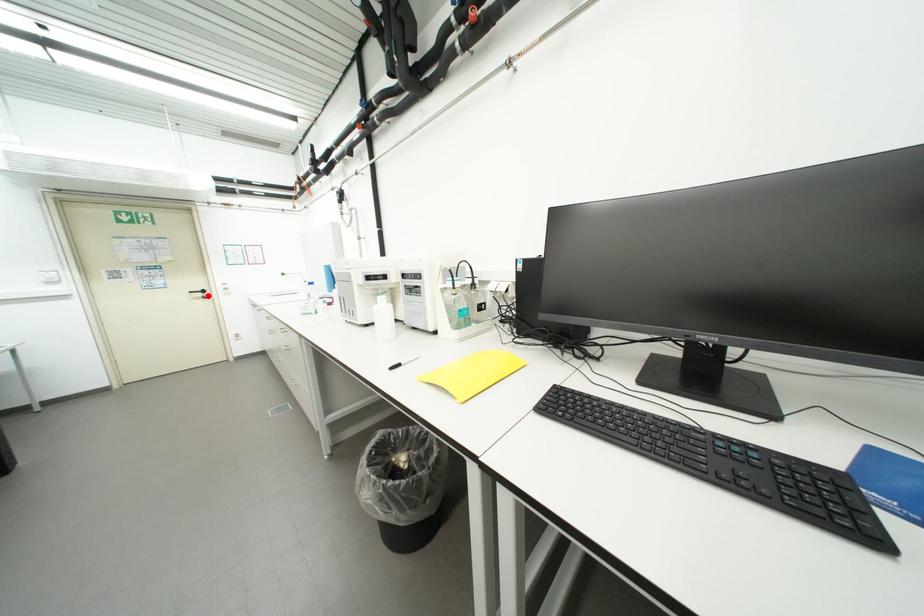
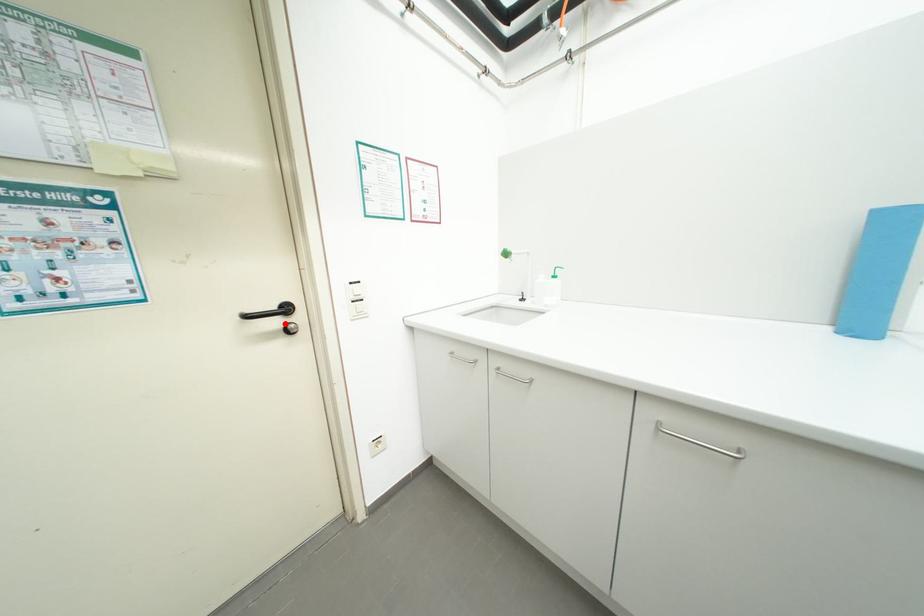
I am providing you with two images of the same scene from different viewpoints. A red point is marked on the first image and another point is marked on the second image. Does the point marked in image1 correspond to the same location as the one in image2?

Yes